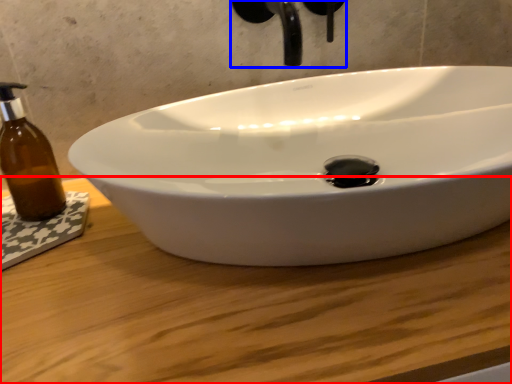
Question: Which object appears closest to the camera in this image, counter top (highlighted by a red box) or plumbing fixture (highlighted by a blue box)?

Choices:
 (A) counter top
 (B) plumbing fixture

Answer: (A)